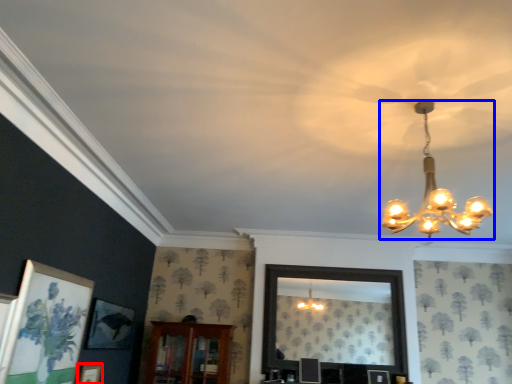
Question: Among these objects, which one is farthest to the camera, picture frame (highlighted by a red box) or lamp (highlighted by a blue box)?

Choices:
 (A) picture frame
 (B) lamp

Answer: (A)